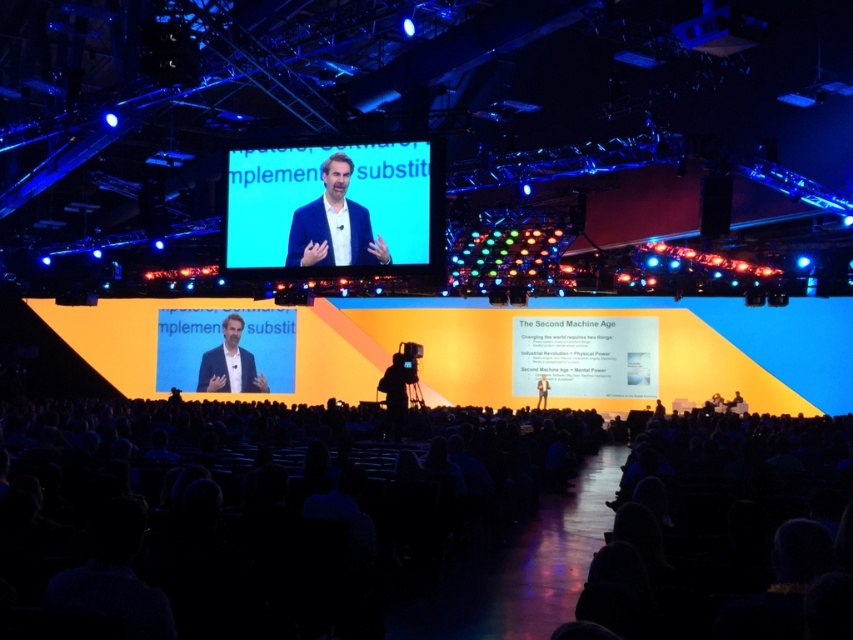
You are standing at point (x=421, y=225) and want to walk to the stage. The stage is 104.98 feet away. If your walking speed is 3 feet per second, how many seconds will it take you to reach the stage?

The distance to the stage is 104.98 feet, and walking at 3 feet per second, it will take approximately 34.99 seconds to reach the stage.

You are an event organizer who needs to adjust the stage layout. You have two blue fabrics available. The first is the blue fabric screen at center, and the second is the blue fabric at upper center. Which of these two fabrics is wider?

The blue fabric screen at center is wider than the blue fabric at upper center according to the description.

You are an event planner checking the stage setup. You need to ensure that the dark blue fabric at lower center and the matte black suit at center are visible to the audience. Given their sizes, which one might be more easily seen from the back row?

The dark blue fabric at lower center is larger in size than the matte black suit at center, so it will be more easily seen from the back row.